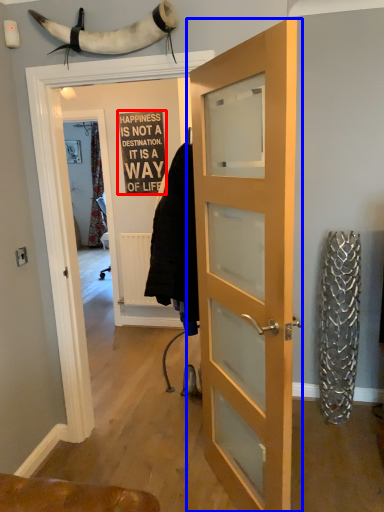
Question: Which point is further to the camera, writing (highlighted by a red box) or door (highlighted by a blue box)?

Choices:
 (A) writing
 (B) door

Answer: (A)